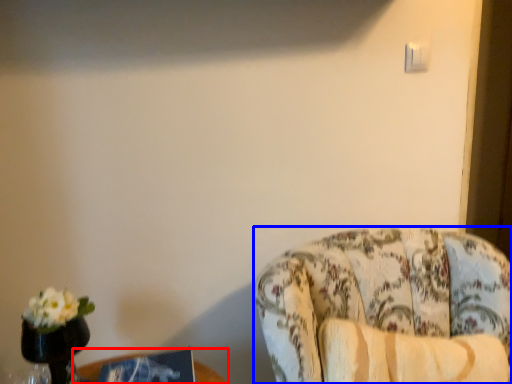
Question: Which point is closer to the camera, table (highlighted by a red box) or chair (highlighted by a blue box)?

Choices:
 (A) table
 (B) chair

Answer: (B)